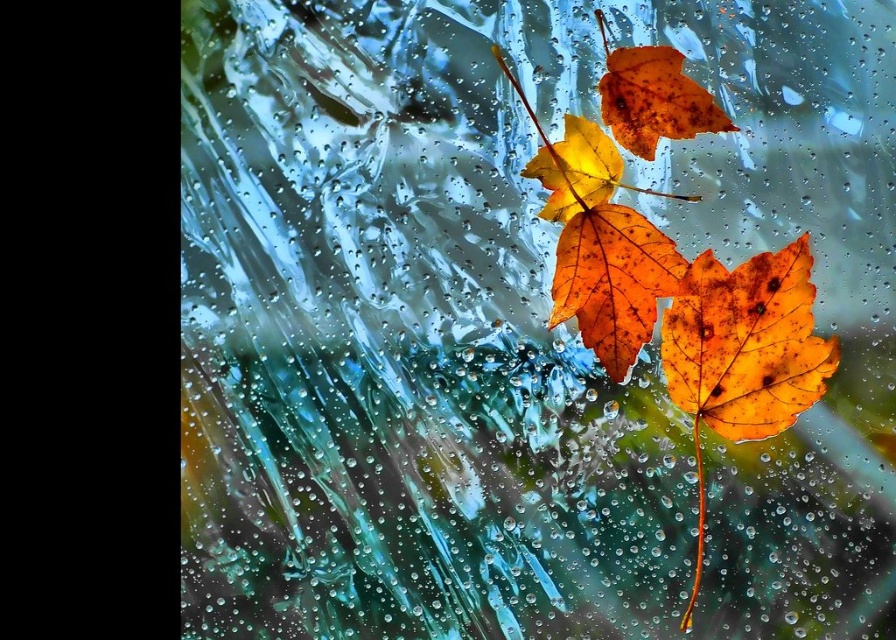
Question: Based on their relative distances, which object is nearer to the shiny orange leaves at center?

Choices:
 (A) matte orange leaf at center
 (B) rustic brown leaf at upper center
 (C) orange matte maple leaf at center

Answer: (A)

Question: Is orange matte maple leaf at center wider than rustic brown leaf at upper center?

Choices:
 (A) no
 (B) yes

Answer: (A)

Question: Among these objects, which one is nearest to the camera?

Choices:
 (A) orange matte maple leaf at center
 (B) matte orange leaf at center

Answer: (B)

Question: Where is matte orange leaf at center located in relation to orange matte maple leaf at center in the image?

Choices:
 (A) below
 (B) above

Answer: (A)

Question: Which of the following is the farthest from the observer?

Choices:
 (A) (679, 339)
 (B) (816, 374)
 (C) (622, 51)

Answer: (C)

Question: Where is shiny orange leaves at center located in relation to rustic brown leaf at upper center in the image?

Choices:
 (A) below
 (B) above

Answer: (A)